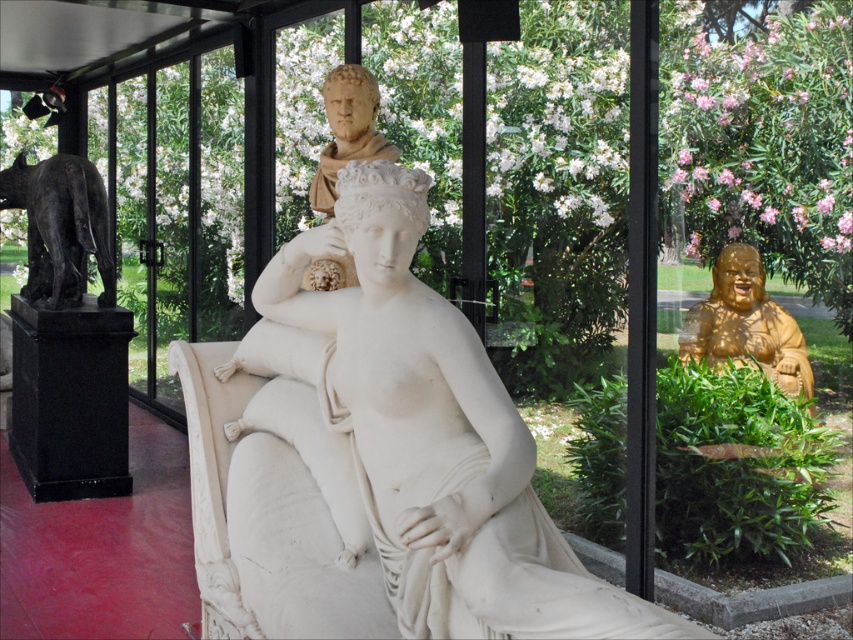
Question: Considering the relative positions of white marble statue at center and gold polished statue at right in the image provided, where is white marble statue at center located with respect to gold polished statue at right?

Choices:
 (A) below
 (B) above

Answer: (A)

Question: Can you confirm if bronze statue at left is positioned to the right of gold polished statue at right?

Choices:
 (A) no
 (B) yes

Answer: (A)

Question: Does white marble statue at center have a larger size compared to gold polished statue at right?

Choices:
 (A) yes
 (B) no

Answer: (A)

Question: Among these points, which one is nearest to the camera?

Choices:
 (A) (67, 193)
 (B) (267, 424)

Answer: (B)

Question: Which point is closer to the camera?

Choices:
 (A) (19, 205)
 (B) (698, 348)
 (C) (444, 614)

Answer: (C)

Question: Which point is farther to the camera?

Choices:
 (A) (381, 561)
 (B) (730, 269)
 (C) (44, 252)

Answer: (C)